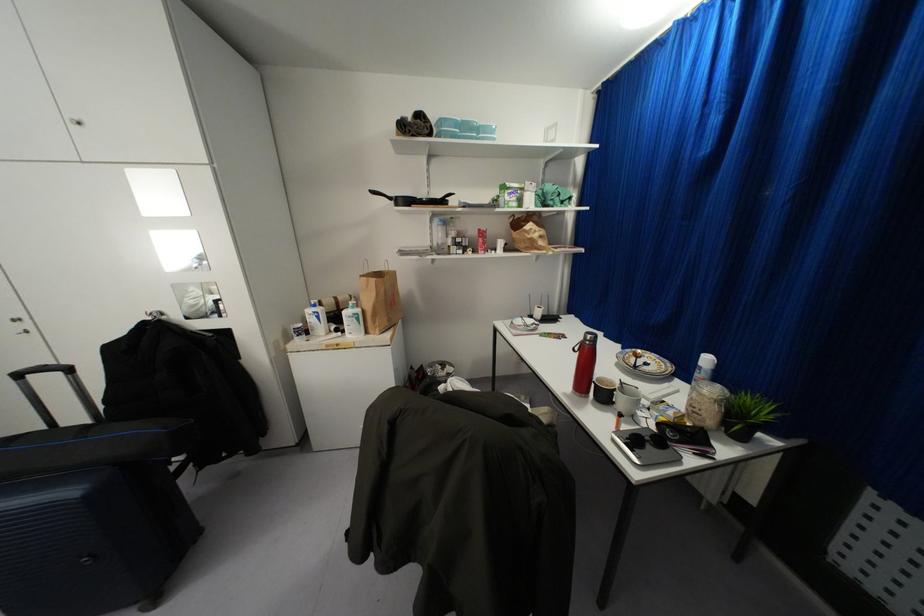
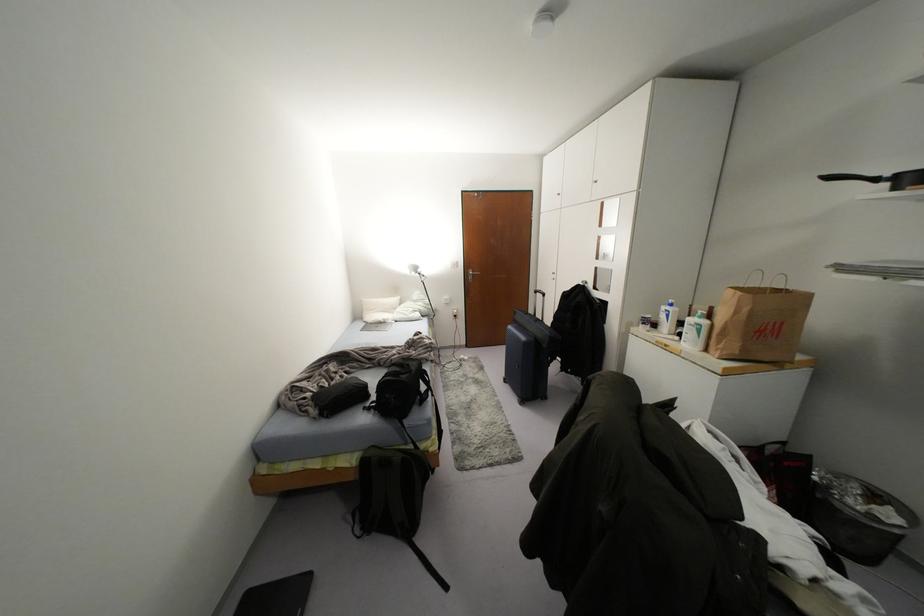
Where in the second image is the point corresponding to point 317,315 from the first image?

(666, 315)